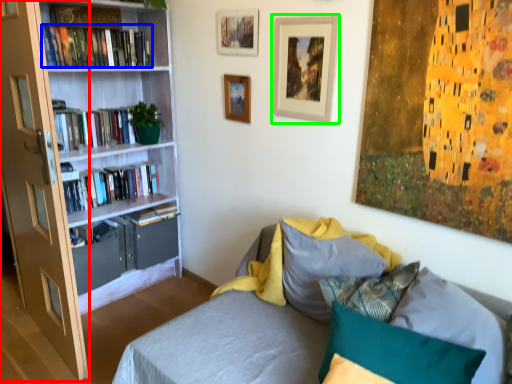
Question: Based on their relative distances, which object is nearer to glass door (highlighted by a red box)? Choose from book (highlighted by a blue box) and picture frame (highlighted by a green box).

Choices:
 (A) book
 (B) picture frame

Answer: (A)